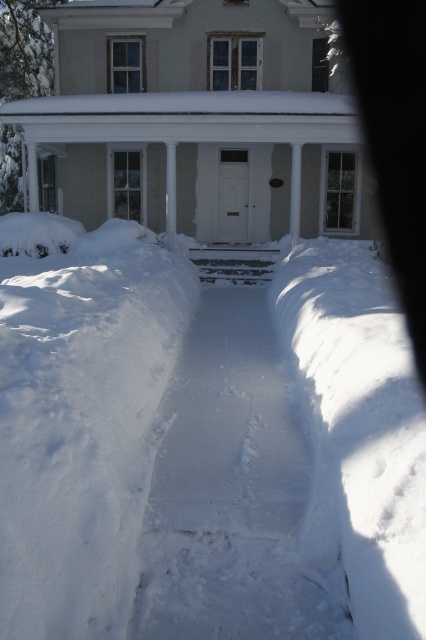
In the scene shown: Is white snow at center thinner than white smooth porch at center?

Yes.

Is point (183, 637) farther from camera compared to point (192, 115)?

No.

Locate an element on the screen. white snow at center is located at coordinates 232,492.